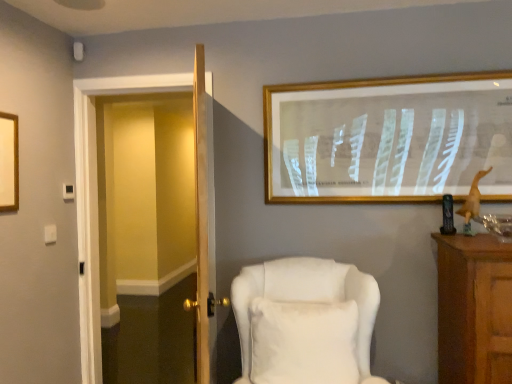
Question: Does gold-framed artwork at upper center contain white fabric chair at center?

Choices:
 (A) yes
 (B) no

Answer: (B)

Question: Does gold-framed artwork at upper center have a greater height compared to white fabric chair at center?

Choices:
 (A) no
 (B) yes

Answer: (A)

Question: Is gold-framed artwork at upper center wider than white fabric chair at center?

Choices:
 (A) yes
 (B) no

Answer: (B)

Question: Considering the relative sizes of gold-framed artwork at upper center and white fabric chair at center in the image provided, is gold-framed artwork at upper center smaller than white fabric chair at center?

Choices:
 (A) no
 (B) yes

Answer: (B)

Question: Is the position of gold-framed artwork at upper center less distant than that of white fabric chair at center?

Choices:
 (A) yes
 (B) no

Answer: (B)

Question: From the image's perspective, is gold-framed artwork at upper center located beneath white fabric chair at center?

Choices:
 (A) no
 (B) yes

Answer: (A)

Question: Can you confirm if white fabric chair at center is smaller than white fluffy pillow at center?

Choices:
 (A) no
 (B) yes

Answer: (A)

Question: Is white fabric chair at center to the left of white fluffy pillow at center from the viewer's perspective?

Choices:
 (A) yes
 (B) no

Answer: (B)

Question: Considering the relative sizes of white fabric chair at center and white fluffy pillow at center in the image provided, is white fabric chair at center shorter than white fluffy pillow at center?

Choices:
 (A) no
 (B) yes

Answer: (A)

Question: Can you confirm if white fabric chair at center is taller than white fluffy pillow at center?

Choices:
 (A) no
 (B) yes

Answer: (B)

Question: From the image's perspective, would you say white fabric chair at center is shown under white fluffy pillow at center?

Choices:
 (A) yes
 (B) no

Answer: (A)

Question: Can you confirm if white fabric chair at center is thinner than white fluffy pillow at center?

Choices:
 (A) no
 (B) yes

Answer: (A)

Question: From the image's perspective, is transparent glass door at left beneath white fluffy pillow at center?

Choices:
 (A) no
 (B) yes

Answer: (A)